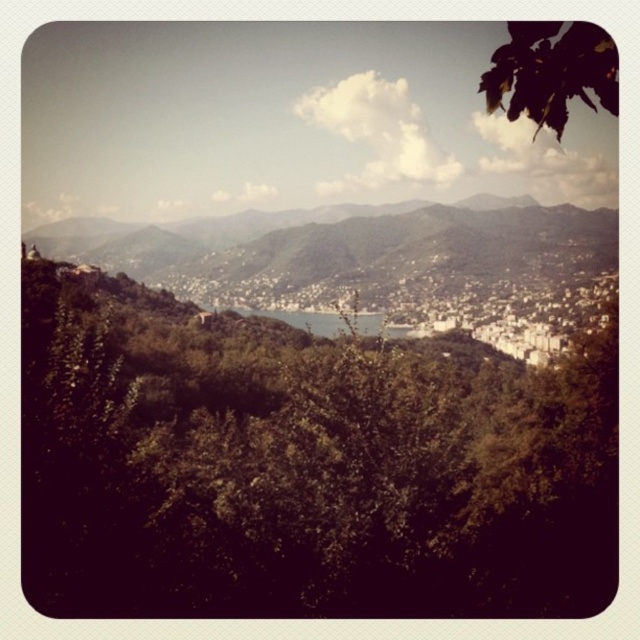
You are standing in the scenic hilly landscape and want to determine which of the two points, point (x=161, y=604) or point (x=445, y=323), is nearer to you. Based on the image, which point is closer?

Point (x=161, y=604) is closer to the viewer than point (x=445, y=323).

You are standing in the scenic hilly landscape and want to take a photo. There are two points of interest marked as point (528, 28) and point (298, 323). Which point is closer to you, the photographer?

Point (528, 28) is closer to the camera than point (298, 323), so it will appear larger and more prominent in your photo.